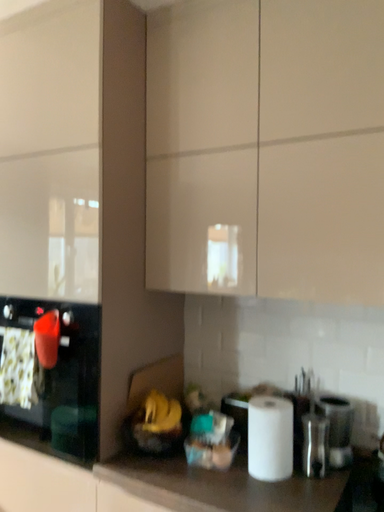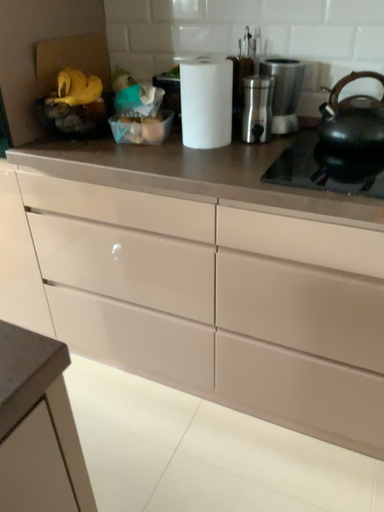
Question: How did the camera likely rotate when shooting the video?

Choices:
 (A) rotated upward
 (B) rotated downward

Answer: (B)